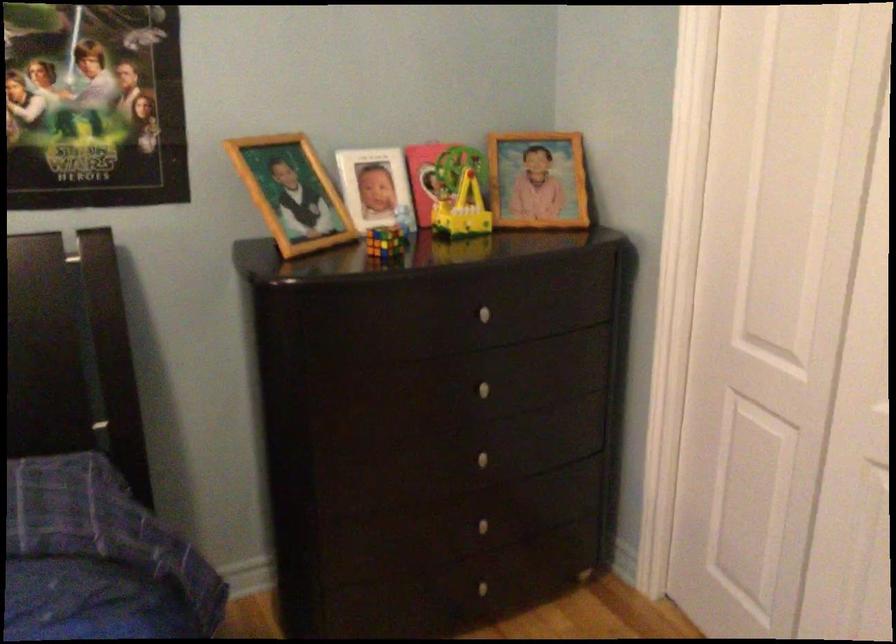
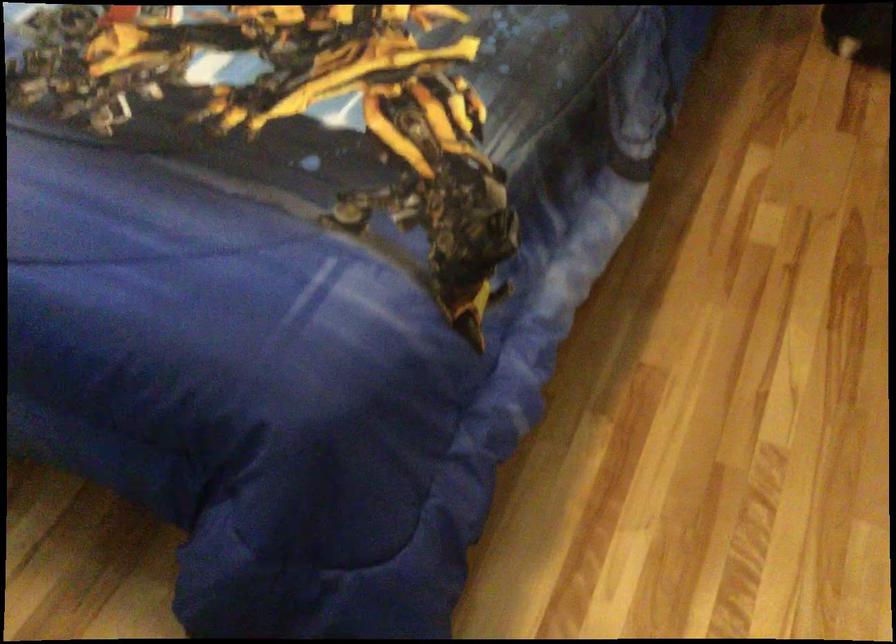
Based on the continuous images, in which direction is the camera rotating?

The camera rotated toward left-down.